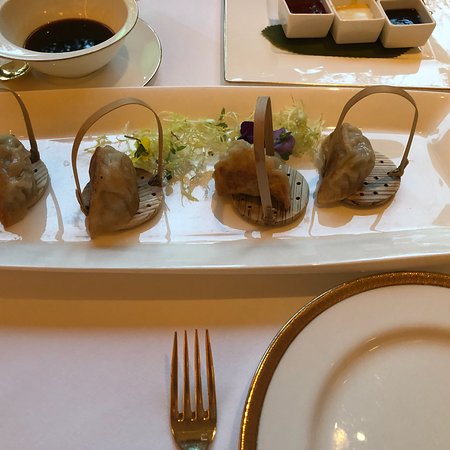
At what (x,y) coordinates should I click in order to perform the action: click on bowl. Please return your answer as a coordinate pair (x, y). The image size is (450, 450). Looking at the image, I should click on click(x=67, y=57).